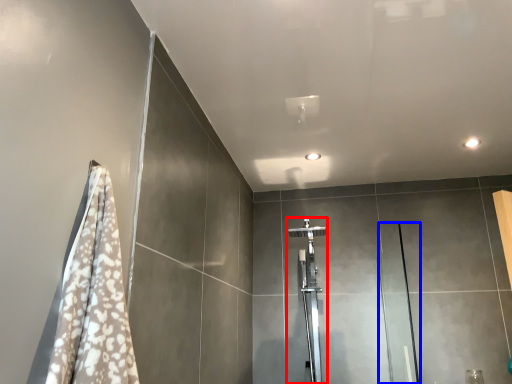
Question: Which object is closer to the camera taking this photo, shower (highlighted by a red box) or screen door (highlighted by a blue box)?

Choices:
 (A) shower
 (B) screen door

Answer: (B)